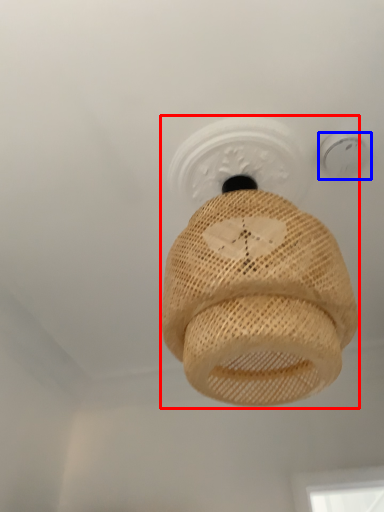
Question: Which object appears closest to the camera in this image, lamp (highlighted by a red box) or light fixture (highlighted by a blue box)?

Choices:
 (A) lamp
 (B) light fixture

Answer: (A)